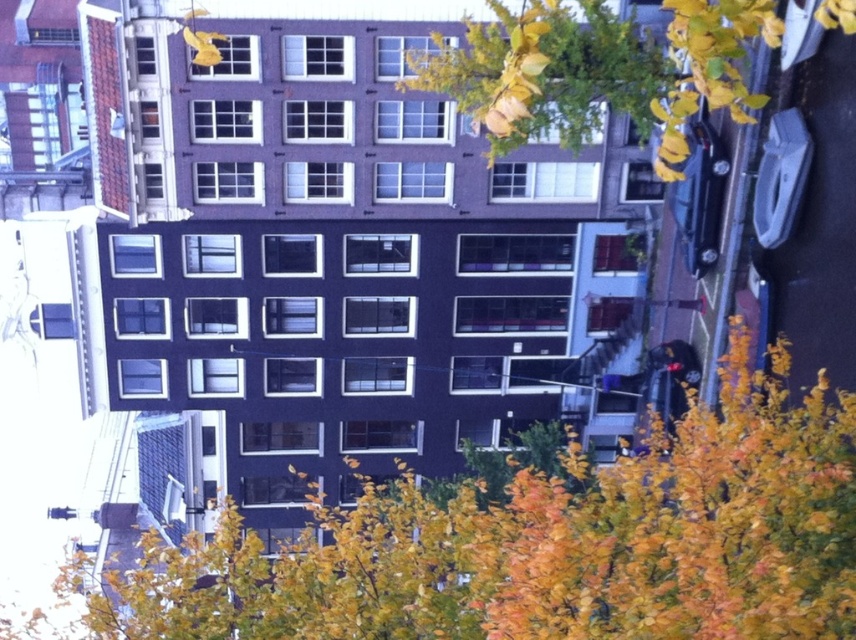
Is point (800, 611) positioned after point (559, 112)?

No.

Is yellow leafy tree at center below yellow-green foliage at upper right?

Yes.

Identify the location of yellow leafy tree at center. (550, 541).